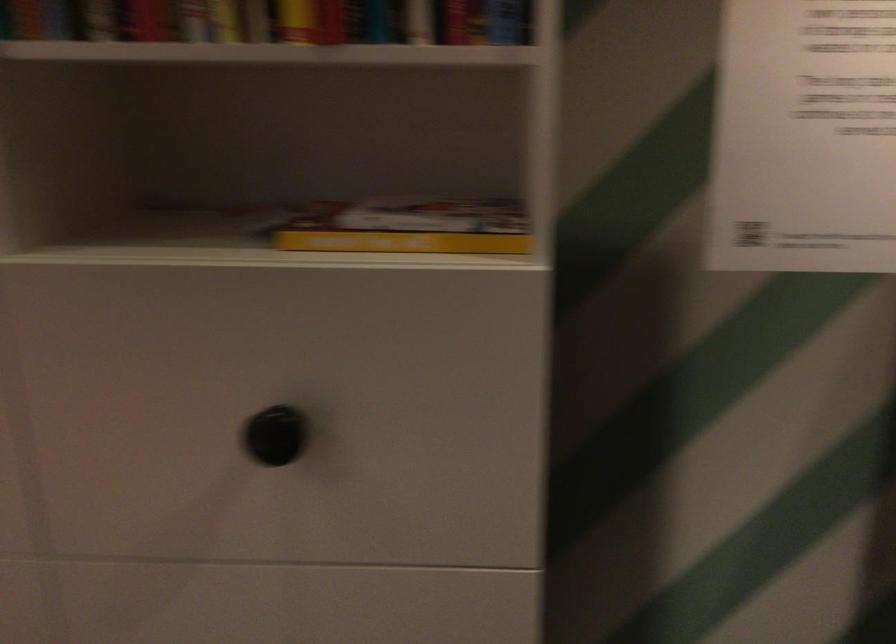
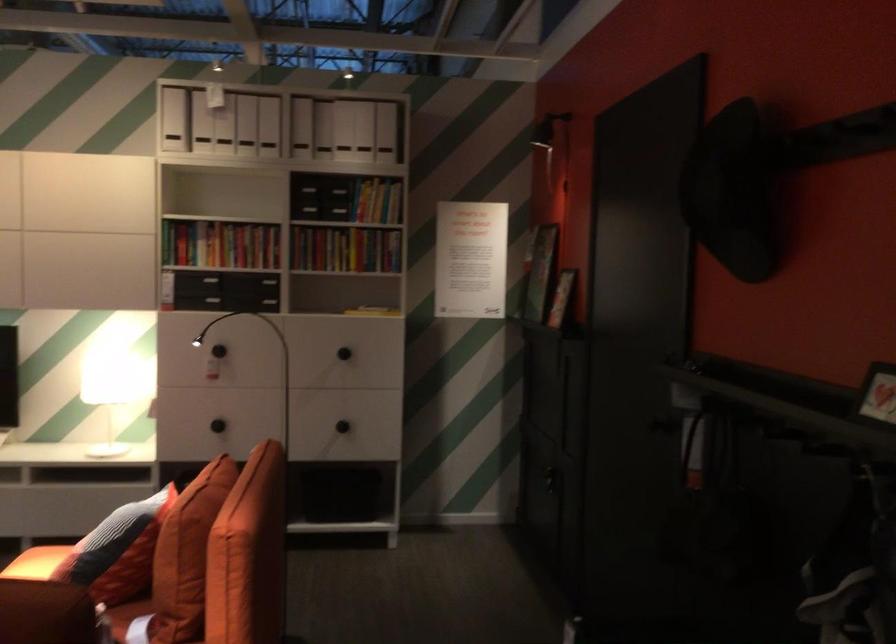
Question: The images are taken continuously from a first-person perspective. In which direction are you moving?

Choices:
 (A) Left
 (B) Right
 (C) Forward
 (D) Backward

Answer: (D)